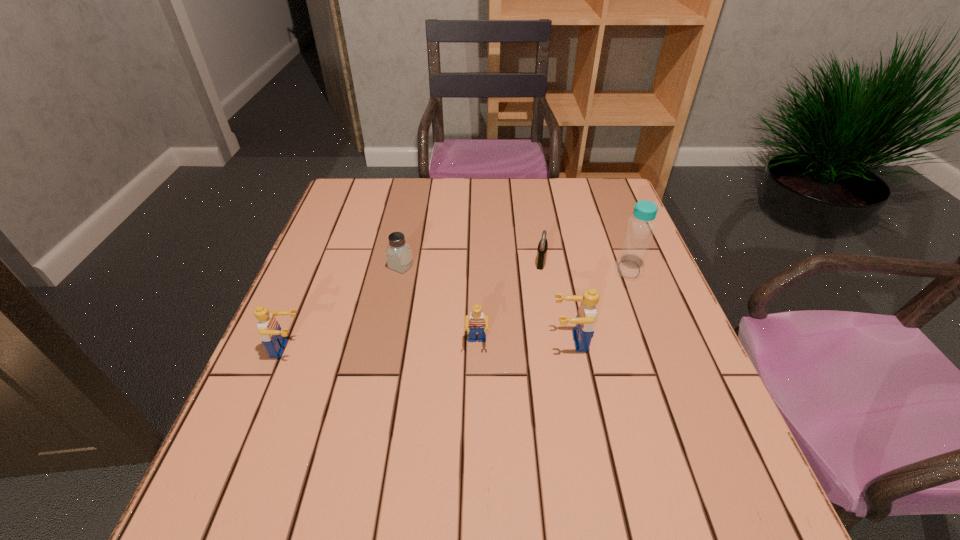
What are the coordinates of `free region located 0.400m on the face of the leftmost Lego` in the screenshot? It's located at (492, 349).

You are a GUI agent. You are given a task and a screenshot of the screen. Output one action in this format:
    pyautogui.click(x=<x>, y=<y>)
    Task: Click on the blank space located on the face of the second Lego from right to left
    This screenshot has width=960, height=540.
    Given the screenshot: What is the action you would take?
    pyautogui.click(x=476, y=418)

Find the location of a particular element. This screenshot has height=540, width=960. vacant space located 0.080m on the face of the fifth shortest object is located at coordinates (515, 341).

Locate an element on the screen. vacant space located on the face of the fifth shortest object is located at coordinates (459, 341).

Where is `vacant space situated 0.060m on the face of the fifth shortest object`? vacant space situated 0.060m on the face of the fifth shortest object is located at coordinates (524, 341).

Where is `vacant space situated 0.220m on the left of the padlock`? The image size is (960, 540). vacant space situated 0.220m on the left of the padlock is located at coordinates (451, 262).

Find the location of a particular element. The image size is (960, 540). vacant space located on the front of the second object from left to right is located at coordinates (379, 373).

Where is `free point located 0.200m on the back of the bottle`? free point located 0.200m on the back of the bottle is located at coordinates (608, 215).

I want to click on object situated at the left edge, so click(x=269, y=329).

Where is `object that is at the right edge`? The image size is (960, 540). object that is at the right edge is located at coordinates (630, 264).